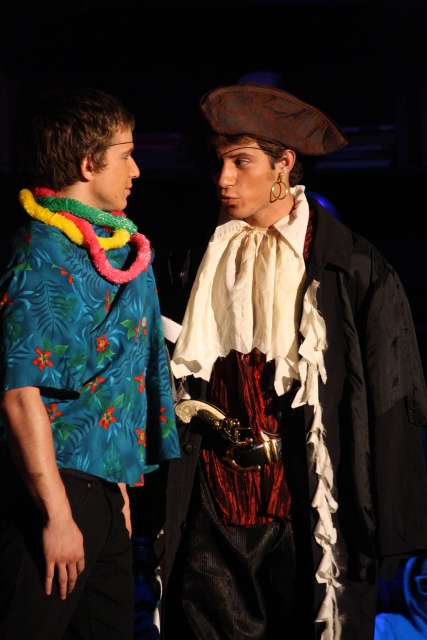
Question: Which point appears closest to the camera in this image?

Choices:
 (A) coord(157,304)
 (B) coord(218,90)

Answer: (B)

Question: Can you confirm if rusty metal pirate hat at upper center is positioned below teal floral shirt at left?

Choices:
 (A) yes
 (B) no

Answer: (B)

Question: Does rusty metal pirate hat at upper center have a lesser width compared to teal floral shirt at left?

Choices:
 (A) yes
 (B) no

Answer: (B)

Question: Is rusty metal pirate hat at upper center wider than teal floral shirt at left?

Choices:
 (A) yes
 (B) no

Answer: (A)